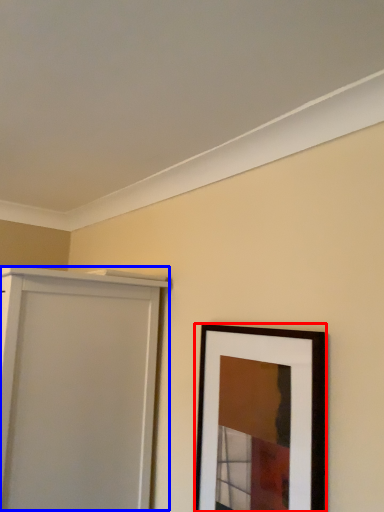
Question: Which object appears closest to the camera in this image, picture frame (highlighted by a red box) or door (highlighted by a blue box)?

Choices:
 (A) picture frame
 (B) door

Answer: (A)